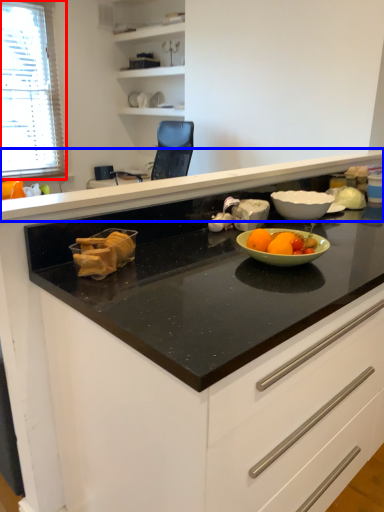
Question: Which of the following is the farthest to the observer, window (highlighted by a red box) or countertop (highlighted by a blue box)?

Choices:
 (A) window
 (B) countertop

Answer: (A)